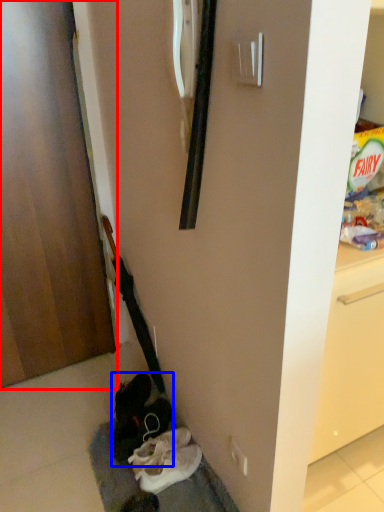
Question: Which of the following is the farthest to the observer, door (highlighted by a red box) or footwear (highlighted by a blue box)?

Choices:
 (A) door
 (B) footwear

Answer: (B)